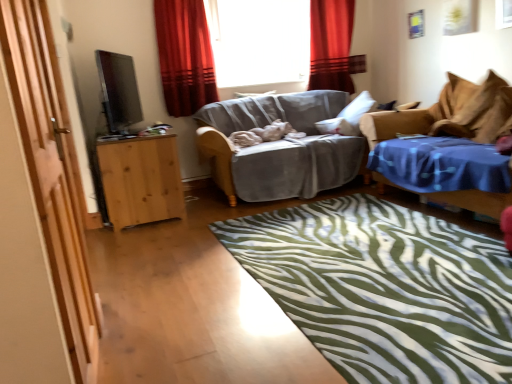
Identify the location of vacant area that lies between wooden door at left and light brown wooden cabinet at left. The width and height of the screenshot is (512, 384). (143, 273).